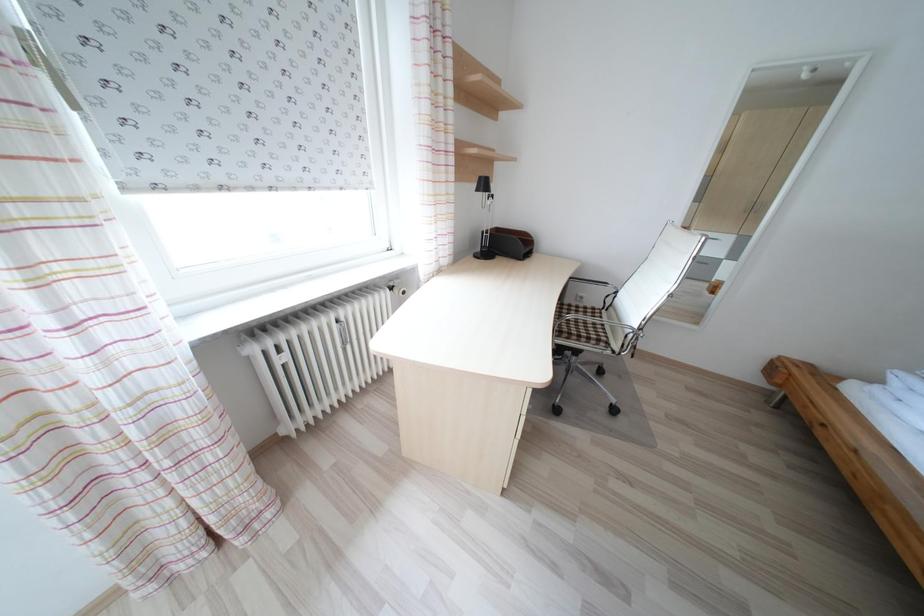
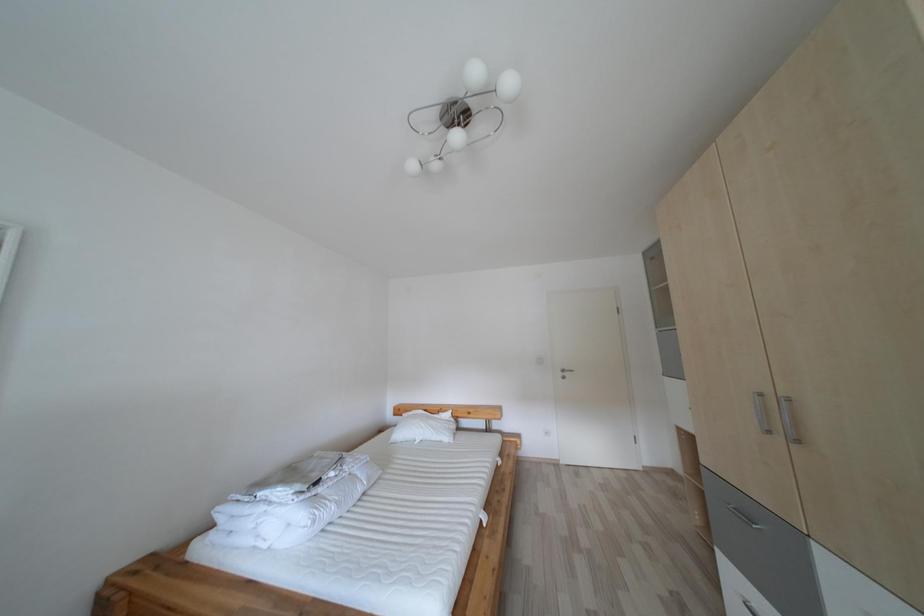
Question: How did the camera likely rotate?

Choices:
 (A) Left
 (B) Right
 (C) Up
 (D) Down

Answer: (B)